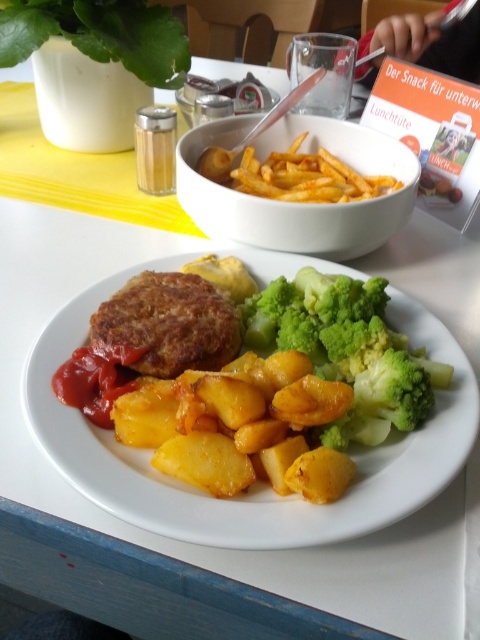
Question: Which point is farther to the camera?

Choices:
 (A) click(233, 330)
 (B) click(184, 65)
 (C) click(271, 298)

Answer: (B)

Question: Can you confirm if green broccoli at center is wider than green leafy vegetable at upper left?

Choices:
 (A) no
 (B) yes

Answer: (A)

Question: Does brown crispy patty at center come behind green leafy vegetable at upper left?

Choices:
 (A) no
 (B) yes

Answer: (A)

Question: Which object is positioned farthest from the green broccoli at center?

Choices:
 (A) green leafy vegetable at upper left
 (B) matte brown plate at center
 (C) brown crispy patty at center

Answer: (A)

Question: Can you confirm if matte brown plate at center is positioned below brown crispy patty at center?

Choices:
 (A) no
 (B) yes

Answer: (B)

Question: Which object is closer to the camera taking this photo?

Choices:
 (A) matte brown plate at center
 (B) green broccoli at center

Answer: (A)